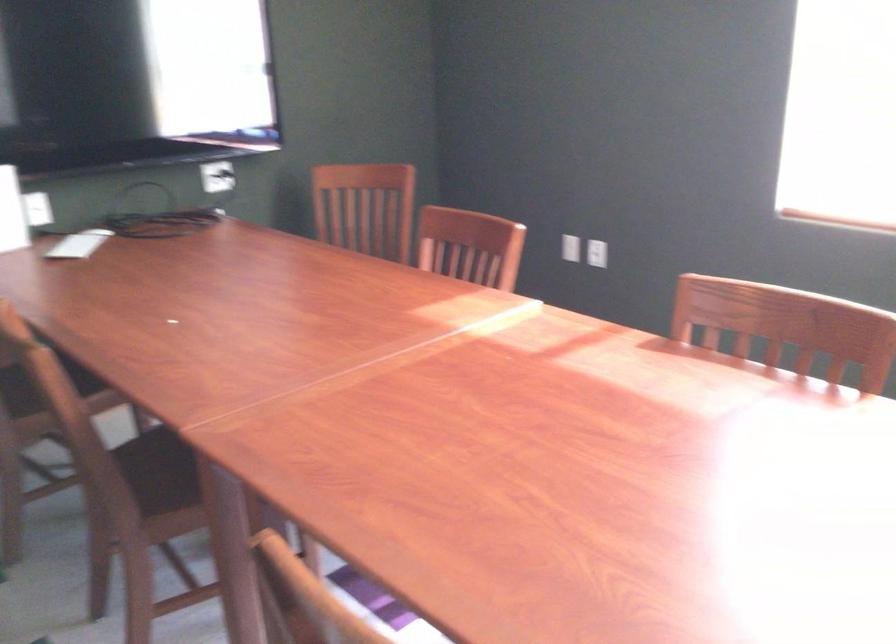
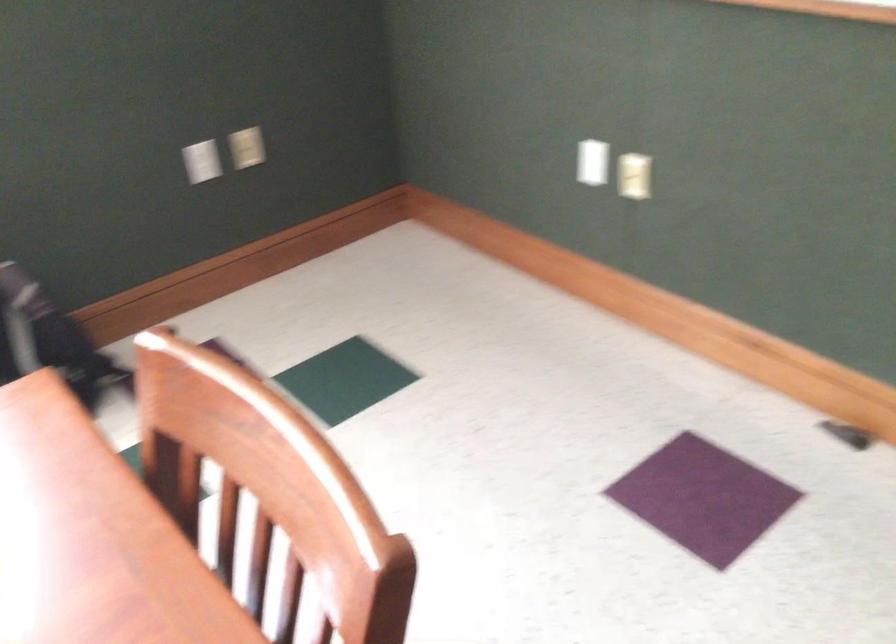
Consider the image. First-person continuous shooting, in which direction is the camera rotating?

The camera's rotation is toward right-down.